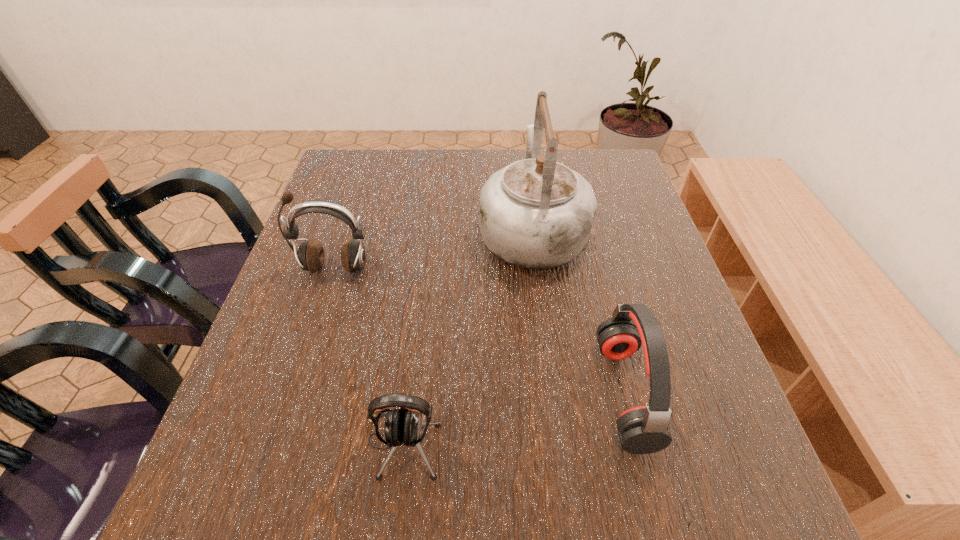
What are the coordinates of `vacant area situated on the ear cups of the rightmost earphone` in the screenshot? It's located at (451, 393).

Find the location of `vacant space located 0.270m on the ear cups of the rightmost earphone`. vacant space located 0.270m on the ear cups of the rightmost earphone is located at coordinates (451, 393).

Identify the location of free location located on the left of the second earphone from right to left. The width and height of the screenshot is (960, 540). (316, 443).

I want to click on object that is at the far edge, so click(536, 213).

You are a GUI agent. You are given a task and a screenshot of the screen. Output one action in this format:
    pyautogui.click(x=<x>, y=<y>)
    Task: Click on the object that is at the near edge
    This screenshot has height=540, width=960.
    Given the screenshot: What is the action you would take?
    pyautogui.click(x=402, y=426)

This screenshot has height=540, width=960. In order to click on object present at the left edge in this screenshot , I will do `click(311, 256)`.

At what (x,y) coordinates should I click in order to perform the action: click on object that is at the right edge. Please return your answer as a coordinate pair (x, y). This screenshot has height=540, width=960. Looking at the image, I should click on (642, 429).

Where is `vacant area at the far edge`? This screenshot has height=540, width=960. vacant area at the far edge is located at coordinates (502, 160).

Find the location of `vacant space at the near edge`. vacant space at the near edge is located at coordinates (649, 482).

At what (x,y) coordinates should I click in order to perform the action: click on vacant point at the left edge. Please return your answer as a coordinate pair (x, y). The height and width of the screenshot is (540, 960). Looking at the image, I should click on (340, 284).